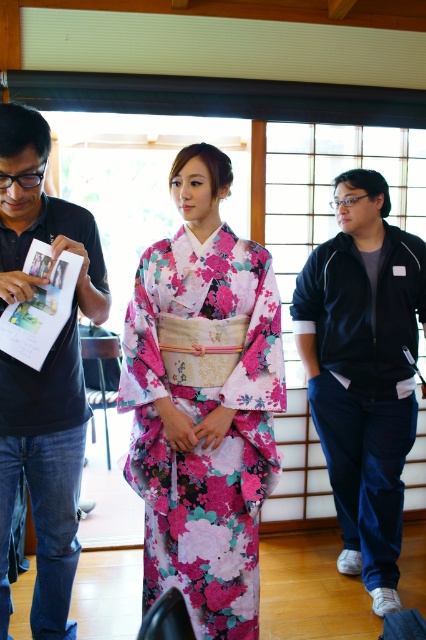
Question: Considering the real-world distances, which object is farthest from the dark blue zip-up jacket at right?

Choices:
 (A) matte black shirt at left
 (B) floral silk kimono at center

Answer: (A)

Question: Which point is farther to the camera?

Choices:
 (A) (2, 550)
 (B) (233, 388)
 (C) (351, 301)

Answer: (C)

Question: Is floral silk kimono at center bigger than matte black shirt at left?

Choices:
 (A) no
 (B) yes

Answer: (A)

Question: Among these points, which one is farthest from the camera?

Choices:
 (A) (17, 198)
 (B) (356, 314)
 (C) (227, 381)

Answer: (B)

Question: Where is dark blue zip-up jacket at right located in relation to matte black shirt at left in the image?

Choices:
 (A) above
 (B) below

Answer: (A)

Question: Does floral silk kimono at center appear on the left side of matte black shirt at left?

Choices:
 (A) no
 (B) yes

Answer: (A)